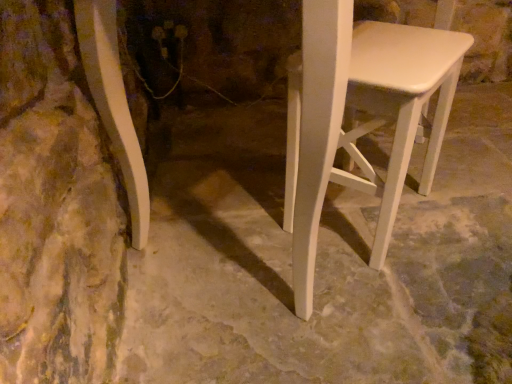
Where is `free space to the left of white matte stool at right`? The image size is (512, 384). free space to the left of white matte stool at right is located at coordinates (240, 221).